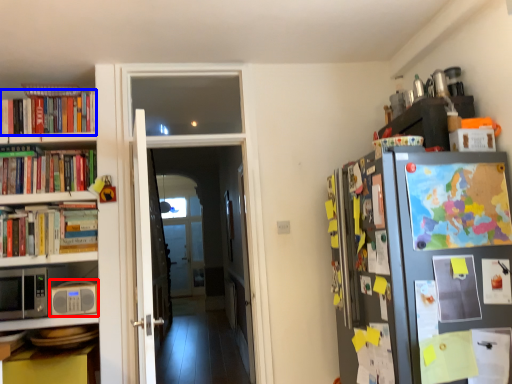
Question: Among these objects, which one is nearest to the camera, appliance (highlighted by a red box) or book (highlighted by a blue box)?

Choices:
 (A) appliance
 (B) book

Answer: (A)